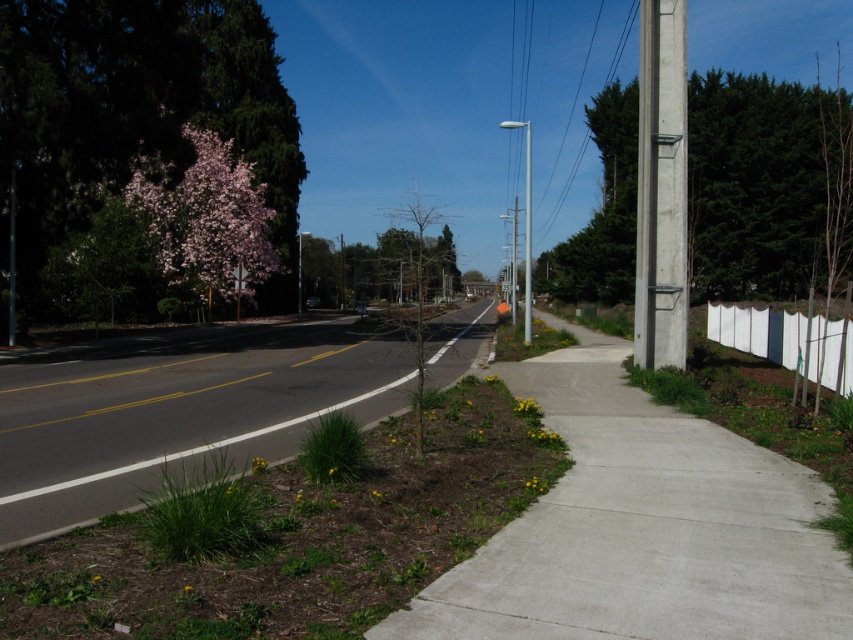
Question: Does pink blossoming tree at left have a greater width compared to green textured pole at right?

Choices:
 (A) yes
 (B) no

Answer: (B)

Question: Is green textured pole at right to the left of white fabric fence at right from the viewer's perspective?

Choices:
 (A) no
 (B) yes

Answer: (A)

Question: Among these objects, which one is nearest to the camera?

Choices:
 (A) bare wood tree at center
 (B) concrete sidewalk at center

Answer: (B)

Question: Is dark asphalt road at lower left below bare wood tree at center?

Choices:
 (A) no
 (B) yes

Answer: (B)

Question: Which of the following is the closest to the observer?

Choices:
 (A) (770, 522)
 (B) (416, 324)
 (C) (786, 216)
 (D) (283, 404)

Answer: (A)

Question: Which object is the closest to the pink bloom tree at left?

Choices:
 (A) concrete sidewalk at center
 (B) pink blossoming tree at left

Answer: (B)